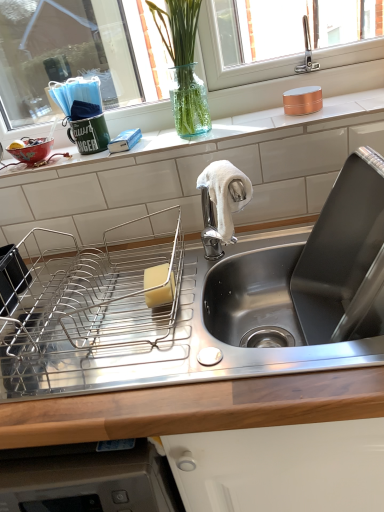
Locate an element on the screen. Image resolution: width=384 pixels, height=512 pixels. metallic wire dish rack at center-left, the second appliance when ordered from right to left is located at coordinates (85, 309).

Describe the element at coordinates (183, 65) in the screenshot. I see `transparent glass vase at upper center` at that location.

Image resolution: width=384 pixels, height=512 pixels. Identify the location of yellow sponge at sink. (161, 294).

Measure the distance between copper metallic canister at upper right, positioned as the 1th appliance in right-to-left order, and camera.

The distance of copper metallic canister at upper right, positioned as the 1th appliance in right-to-left order, from camera is 38.97 inches.

What do you see at coordinates (224, 193) in the screenshot? I see `white soft towel at center` at bounding box center [224, 193].

What do you see at coordinates (242, 131) in the screenshot?
I see `white tile at upper center` at bounding box center [242, 131].

Find the location of `clear glass vase at upper center`. clear glass vase at upper center is located at coordinates (68, 58).

Is stainless steel sink at upper right positioned with its back to white tile at upper center?

stainless steel sink at upper right does not have its back to white tile at upper center.

From the picture: Is stainless steel sink at upper right not close to white tile at upper center?

stainless steel sink at upper right is actually quite close to white tile at upper center.

The image size is (384, 512). I want to click on countertop above the stainless steel sink at upper right (from a real-world perspective), so click(242, 131).

Is transparent glass vase at upper center surrounding metallic wire dish rack at center-left, acting as the first appliance starting from the left?

Actually, metallic wire dish rack at center-left, acting as the first appliance starting from the left, is outside transparent glass vase at upper center.

Are transparent glass vase at upper center and metallic wire dish rack at center-left, acting as the first appliance starting from the left, located far from each other?

No, transparent glass vase at upper center is not far from metallic wire dish rack at center-left, acting as the first appliance starting from the left.

From a real-world perspective, is transparent glass vase at upper center beneath metallic wire dish rack at center-left, acting as the 1th appliance starting from the bottom?

No.

In the image, there is a metallic wire dish rack at center-left, the second appliance in the top-to-bottom sequence. Where is `plant above it (from the image's perspective)`? The width and height of the screenshot is (384, 512). plant above it (from the image's perspective) is located at coordinates (183, 65).

Considering the relative sizes of matte ceramic bowl at left and clear glass vase at upper center in the image provided, is matte ceramic bowl at left shorter than clear glass vase at upper center?

Indeed, matte ceramic bowl at left has a lesser height compared to clear glass vase at upper center.

Between matte ceramic bowl at left and clear glass vase at upper center, which one is positioned in front?

clear glass vase at upper center is more forward.

This screenshot has height=512, width=384. I want to click on window that appears above the matte ceramic bowl at left (from the image's perspective), so click(x=68, y=58).

From a real-world perspective, who is located higher, matte ceramic bowl at left or clear glass vase at upper center?

From a 3D spatial view, clear glass vase at upper center is above.

Is white tile at upper center to the right of yellow sponge at sink from the viewer's perspective?

Indeed, white tile at upper center is positioned on the right side of yellow sponge at sink.

Is the position of white tile at upper center less distant than that of yellow sponge at sink?

No, white tile at upper center is further to the viewer.

Is white tile at upper center looking in the opposite direction of yellow sponge at sink?

No, yellow sponge at sink is not at the back of white tile at upper center.

From the image's perspective, which is above, white tile at upper center or yellow sponge at sink?

From the image's view, white tile at upper center is above.

Which is farther from the camera, (287, 102) or (28, 151)?

Positioned behind is point (28, 151).

Is copper metallic canister at upper right, the second appliance from the bottom, completely or partially outside of matte ceramic bowl at left?

Yes, copper metallic canister at upper right, the second appliance from the bottom, is not within matte ceramic bowl at left.

Is there a large distance between copper metallic canister at upper right, the second appliance from the bottom, and matte ceramic bowl at left?

copper metallic canister at upper right, the second appliance from the bottom, is near matte ceramic bowl at left, not far away.

Is copper metallic canister at upper right, the second appliance from the bottom, bigger than matte ceramic bowl at left?

Actually, copper metallic canister at upper right, the second appliance from the bottom, might be smaller than matte ceramic bowl at left.

Does white tile at upper center have a lesser height compared to white soft towel at center?

Yes.

Is white tile at upper center aimed at white soft towel at center?

No.

The image size is (384, 512). What are the coordinates of `cloth on the right of white tile at upper center` in the screenshot? It's located at (224, 193).

This screenshot has width=384, height=512. Find the location of `cloth to the right of clear glass vase at upper center`. cloth to the right of clear glass vase at upper center is located at coordinates (224, 193).

From a real-world perspective, between clear glass vase at upper center and white soft towel at center, who is vertically lower?

In real-world perspective, white soft towel at center is lower.

In the scene shown: Which point is more forward, (223, 56) or (218, 189)?

Point (218, 189)

From the image's perspective, between clear glass vase at upper center and white soft towel at center, which one is located above?

clear glass vase at upper center.

This screenshot has height=512, width=384. In order to click on sink in front of the white tile at upper center in this screenshot , I will do `click(310, 274)`.

Where is `the 2nd appliance below when counting from the transparent glass vase at upper center (from the image's perspective)`? the 2nd appliance below when counting from the transparent glass vase at upper center (from the image's perspective) is located at coordinates (85, 309).

Looking at the image, which one is located closer to clear glass vase at upper center, white soft towel at center or yellow sponge at sink?

Based on the image, white soft towel at center appears to be nearer to clear glass vase at upper center.

When comparing their distances from white tile at upper center, does matte ceramic bowl at left or stainless steel sink at upper right seem closer?

Among the two, stainless steel sink at upper right is located nearer to white tile at upper center.

Looking at the image, which one is located closer to stainless steel sink at upper right, copper metallic canister at upper right, arranged as the second appliance when viewed from the left, or white soft towel at center?

white soft towel at center lies closer to stainless steel sink at upper right than the other object.

Looking at the image, which one is located further to matte ceramic bowl at left, metallic wire dish rack at center-left, acting as the first appliance starting from the left, or clear glass vase at upper center?

clear glass vase at upper center is positioned further to the anchor matte ceramic bowl at left.

Which object lies further to the anchor point metallic wire dish rack at center-left, the second appliance when ordered from right to left, copper metallic canister at upper right, positioned as the 1th appliance in right-to-left order, or matte ceramic bowl at left?

copper metallic canister at upper right, positioned as the 1th appliance in right-to-left order.

Looking at the image, which one is located further to yellow sponge at sink, stainless steel sink at upper right or metallic wire dish rack at center-left, the second appliance in the top-to-bottom sequence?

stainless steel sink at upper right is positioned further to the anchor yellow sponge at sink.

Looking at the image, which one is located closer to stainless steel sink at upper right, white soft towel at center or copper metallic canister at upper right, arranged as the second appliance when viewed from the left?

white soft towel at center.

In the scene shown: Considering their positions, is clear glass vase at upper center positioned further to white soft towel at center than white tile at upper center?

clear glass vase at upper center is positioned further to the anchor white soft towel at center.

At what (x,y) coordinates should I click in order to perform the action: click on food between matte ceramic bowl at left and copper metallic canister at upper right, positioned as the first appliance in top-to-bottom order, from left to right. Please return your answer as a coordinate pair (x, y). The height and width of the screenshot is (512, 384). Looking at the image, I should click on (161, 294).

Locate an element on the screen. The height and width of the screenshot is (512, 384). plant between clear glass vase at upper center and stainless steel sink at upper right in the vertical direction is located at coordinates (183, 65).

The width and height of the screenshot is (384, 512). In order to click on food situated between metallic wire dish rack at center-left, the second appliance when ordered from right to left, and white soft towel at center from left to right in this screenshot , I will do `click(161, 294)`.

The width and height of the screenshot is (384, 512). I want to click on cloth between transparent glass vase at upper center and stainless steel sink at upper right vertically, so click(x=224, y=193).